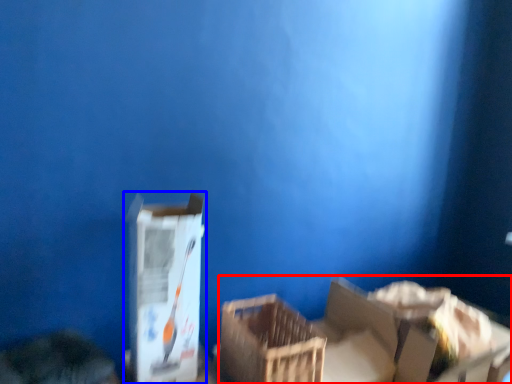
Question: Which of the following is the closest to the observer, storage box (highlighted by a red box) or box (highlighted by a blue box)?

Choices:
 (A) storage box
 (B) box

Answer: (B)